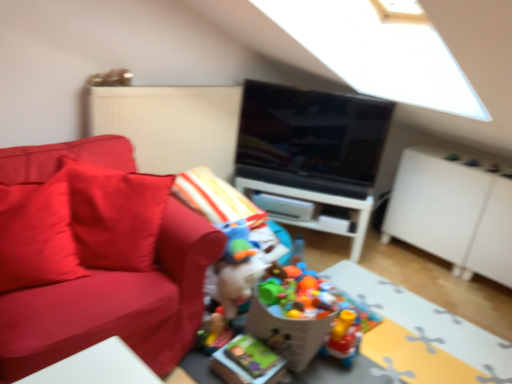
Question: Should I look upward or downward to see plastic colorful toys at center, which is counted as the 3th toy, starting from the front?

Choices:
 (A) down
 (B) up

Answer: (A)

Question: Does matte red pillow at left come behind white matte dresser at right?

Choices:
 (A) no
 (B) yes

Answer: (A)

Question: Is matte red pillow at left located outside white matte dresser at right?

Choices:
 (A) yes
 (B) no

Answer: (A)

Question: Does matte red pillow at left have a larger size compared to white matte dresser at right?

Choices:
 (A) no
 (B) yes

Answer: (A)

Question: Is matte red pillow at left surrounding white matte dresser at right?

Choices:
 (A) yes
 (B) no

Answer: (B)

Question: Could you tell me if matte red pillow at left is turned towards white matte dresser at right?

Choices:
 (A) no
 (B) yes

Answer: (A)

Question: Can you confirm if matte red pillow at left is thinner than white matte dresser at right?

Choices:
 (A) yes
 (B) no

Answer: (B)

Question: Is white matte dresser at right located within black glossy tv at center?

Choices:
 (A) yes
 (B) no

Answer: (B)

Question: Does black glossy tv at center have a greater height compared to white matte dresser at right?

Choices:
 (A) yes
 (B) no

Answer: (B)

Question: Considering the relative positions of black glossy tv at center and white matte dresser at right in the image provided, is black glossy tv at center to the right of white matte dresser at right from the viewer's perspective?

Choices:
 (A) no
 (B) yes

Answer: (A)

Question: Can you confirm if black glossy tv at center is smaller than white matte dresser at right?

Choices:
 (A) no
 (B) yes

Answer: (B)

Question: Is black glossy tv at center positioned behind white matte dresser at right?

Choices:
 (A) no
 (B) yes

Answer: (B)

Question: Does black glossy tv at center lie in front of white matte dresser at right?

Choices:
 (A) no
 (B) yes

Answer: (A)

Question: From a real-world perspective, is plastic colorful toys at center, arranged as the 1th toy when viewed from the back, located higher than cardboard box at center, marked as the first table in a front-to-back arrangement?

Choices:
 (A) yes
 (B) no

Answer: (A)